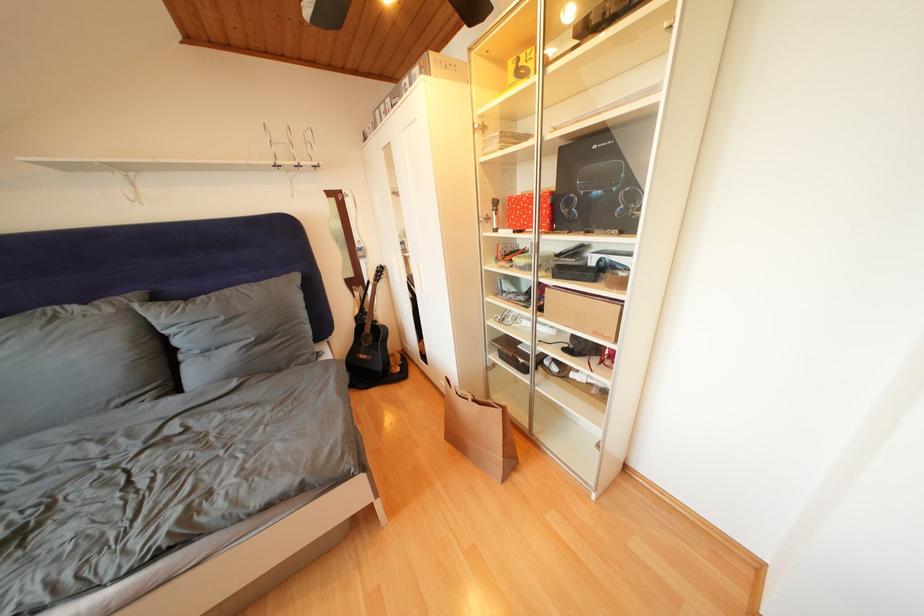
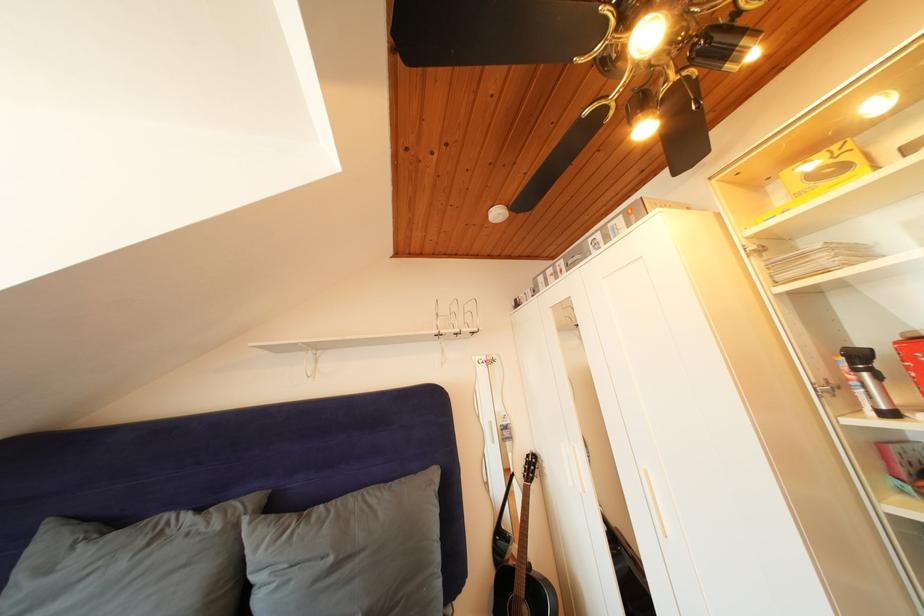
How did the camera likely rotate?

The camera's rotation is toward left-up.